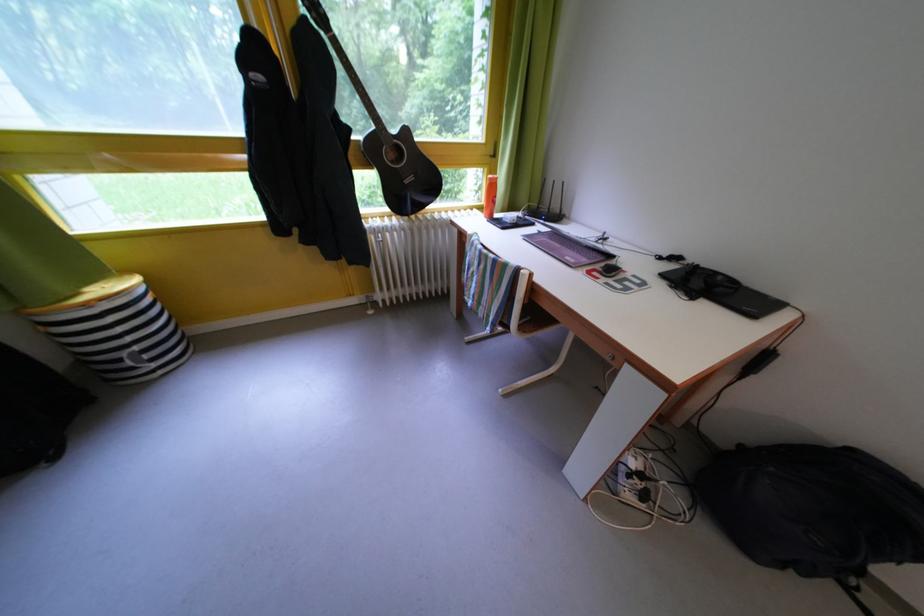
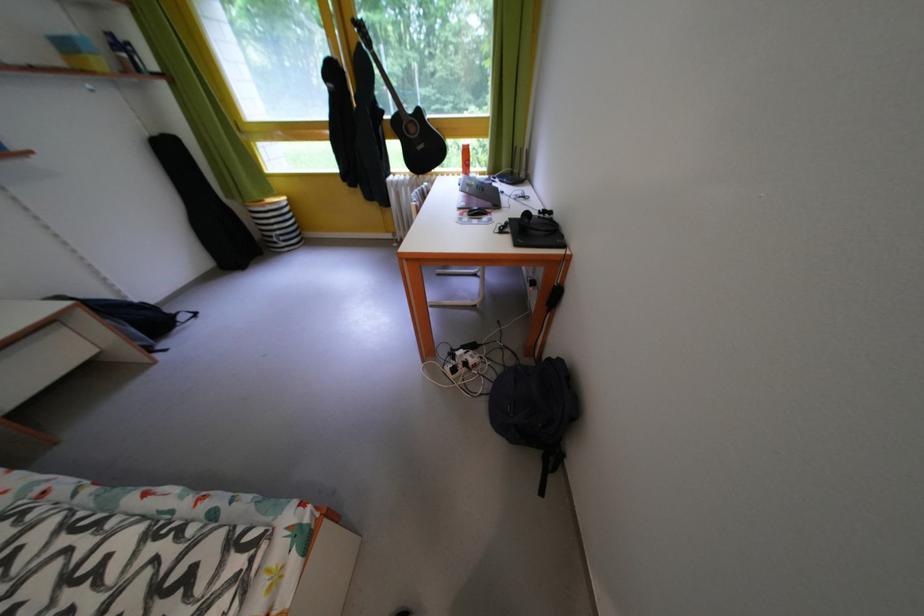
Question: Which direction would the cameraman need to move to produce the second image? Reply with the corresponding letter.

Choices:
 (A) Left
 (B) Right
 (C) Forward
 (D) Backward

Answer: (B)